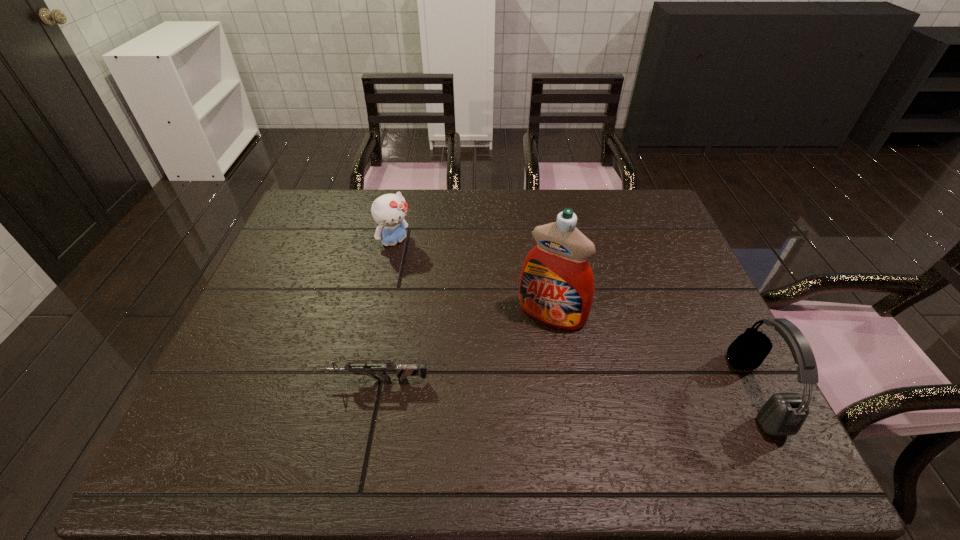
Image resolution: width=960 pixels, height=540 pixels. I want to click on object located in the near right corner section of the desktop, so click(x=783, y=414).

I want to click on vacant space at the far edge of the desktop, so click(516, 190).

Locate an element on the screen. free location at the left edge of the desktop is located at coordinates (248, 331).

Find the location of `free region at the right edge`. free region at the right edge is located at coordinates (711, 320).

In the image, there is a desktop. Where is `blank space at the far right corner`? Image resolution: width=960 pixels, height=540 pixels. blank space at the far right corner is located at coordinates (633, 191).

The height and width of the screenshot is (540, 960). I want to click on vacant space that is in between the second farthest object and the rightmost object, so point(654,354).

Find the location of a particular element. vacant region between the shortest object and the detergent is located at coordinates (464, 347).

Find the location of a particular element. empty space that is in between the detergent and the gun is located at coordinates (464, 347).

Find the location of a particular element. The image size is (960, 540). empty space between the shortest object and the third shortest object is located at coordinates [566, 386].

At what (x,y) coordinates should I click in order to perform the action: click on blank region between the rightmost object and the shortest object. Please return your answer as a coordinate pair (x, y). The height and width of the screenshot is (540, 960). Looking at the image, I should click on (566, 386).